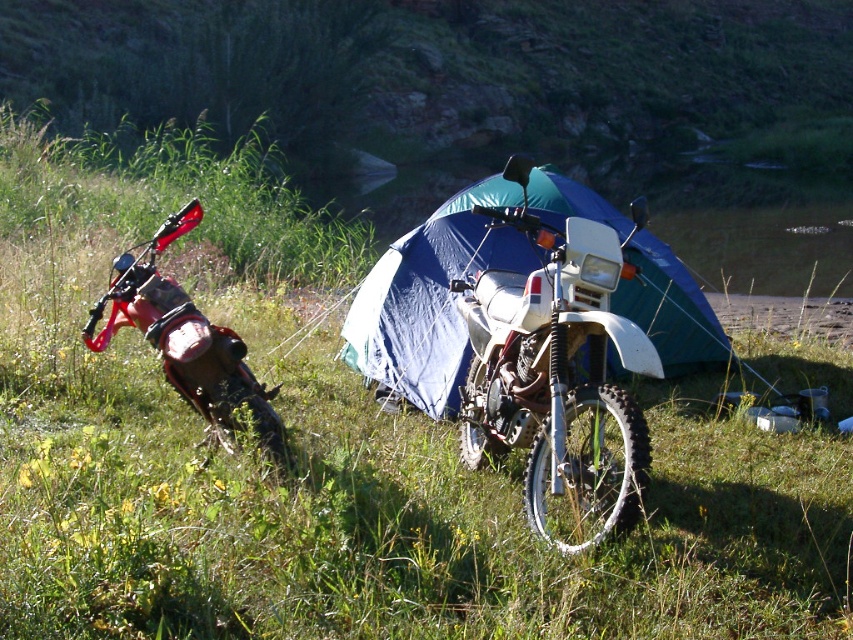
Between point (428, 269) and point (184, 296), which one is positioned behind?

Positioned behind is point (428, 269).

Does blue fabric tent at center appear on the left side of brushed metal motorcycle at left?

Incorrect, blue fabric tent at center is not on the left side of brushed metal motorcycle at left.

This screenshot has height=640, width=853. What do you see at coordinates (430, 298) in the screenshot?
I see `blue fabric tent at center` at bounding box center [430, 298].

This screenshot has width=853, height=640. What are the coordinates of `blue fabric tent at center` in the screenshot? It's located at (430, 298).

Does white matte motorcycle at center appear over brushed metal motorcycle at left?

Yes, white matte motorcycle at center is above brushed metal motorcycle at left.

The image size is (853, 640). Describe the element at coordinates (556, 378) in the screenshot. I see `white matte motorcycle at center` at that location.

Does point (572, 480) lie in front of point (165, 339)?

Yes, point (572, 480) is in front of point (165, 339).

Identify the location of white matte motorcycle at center. (556, 378).

Which is more to the left, white matte motorcycle at center or blue fabric tent at center?

white matte motorcycle at center

Which is below, white matte motorcycle at center or blue fabric tent at center?

Positioned lower is white matte motorcycle at center.

Measure the distance between white matte motorcycle at center and camera.

The distance of white matte motorcycle at center from camera is 3.06 meters.

The image size is (853, 640). Find the location of `white matte motorcycle at center`. white matte motorcycle at center is located at coordinates (556, 378).